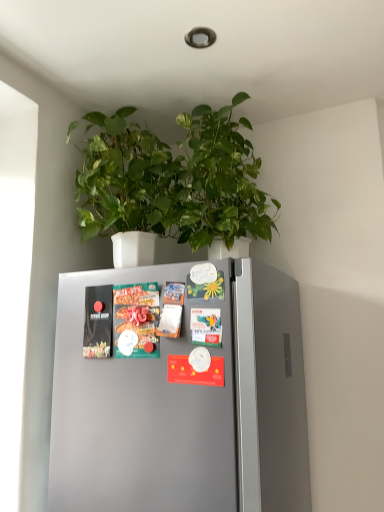
Question: Is matte plastic magazine at center, which is the first magazine in right-to-left order, at the back of green glossy leaves at upper center?

Choices:
 (A) no
 (B) yes

Answer: (A)

Question: Is green glossy leaves at upper center outside matte plastic magazine at center, the 2th magazine from the left?

Choices:
 (A) yes
 (B) no

Answer: (A)

Question: Considering the relative sizes of green glossy leaves at upper center and matte plastic magazine at center, which is the first magazine in right-to-left order, in the image provided, is green glossy leaves at upper center thinner than matte plastic magazine at center, which is the first magazine in right-to-left order,?

Choices:
 (A) yes
 (B) no

Answer: (B)

Question: Is green glossy leaves at upper center bigger than matte plastic magazine at center, the 2th magazine from the left?

Choices:
 (A) yes
 (B) no

Answer: (A)

Question: Is green glossy leaves at upper center at the right side of matte plastic magazine at center, the 2th magazine from the left?

Choices:
 (A) no
 (B) yes

Answer: (B)

Question: From a real-world perspective, is matte plastic magazine at center, which is the first magazine in right-to-left order, positioned above or below green glossy leaves at upper center?

Choices:
 (A) above
 (B) below

Answer: (B)

Question: From their relative heights in the image, would you say matte plastic magazine at center, which is the first magazine in right-to-left order, is taller or shorter than green glossy leaves at upper center?

Choices:
 (A) tall
 (B) short

Answer: (B)

Question: From the image's perspective, is matte plastic magazine at center, the 2th magazine from the left, located above or below green glossy leaves at upper center?

Choices:
 (A) below
 (B) above

Answer: (A)

Question: Is matte plastic magazine at center, which is the first magazine in right-to-left order, situated inside green glossy leaves at upper center or outside?

Choices:
 (A) inside
 (B) outside

Answer: (B)

Question: From a real-world perspective, is matte black magazine at left, placed as the second magazine when sorted from right to left, positioned above or below green glossy leaves at upper center?

Choices:
 (A) below
 (B) above

Answer: (A)

Question: Would you say matte black magazine at left, placed as the second magazine when sorted from right to left, is to the left or to the right of green glossy leaves at upper center in the picture?

Choices:
 (A) right
 (B) left

Answer: (B)

Question: Considering the positions of matte black magazine at left, marked as the first magazine in a left-to-right arrangement, and green glossy leaves at upper center in the image, is matte black magazine at left, marked as the first magazine in a left-to-right arrangement, bigger or smaller than green glossy leaves at upper center?

Choices:
 (A) big
 (B) small

Answer: (B)

Question: From their relative heights in the image, would you say matte black magazine at left, marked as the first magazine in a left-to-right arrangement, is taller or shorter than green glossy leaves at upper center?

Choices:
 (A) tall
 (B) short

Answer: (B)

Question: From the image's perspective, is matte black magazine at left, placed as the second magazine when sorted from right to left, located above or below matte plastic magazine at center, which is the first magazine in right-to-left order?

Choices:
 (A) below
 (B) above

Answer: (A)

Question: Is matte black magazine at left, marked as the first magazine in a left-to-right arrangement, in front of or behind matte plastic magazine at center, which is the first magazine in right-to-left order, in the image?

Choices:
 (A) front
 (B) behind

Answer: (B)